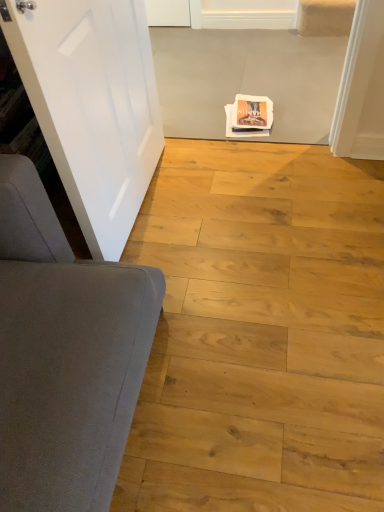
Question: Are white matte door at left and natural wood floor at center located far from each other?

Choices:
 (A) yes
 (B) no

Answer: (B)

Question: Is white matte door at left thinner than natural wood floor at center?

Choices:
 (A) yes
 (B) no

Answer: (A)

Question: From a real-world perspective, is white matte door at left positioned under natural wood floor at center based on gravity?

Choices:
 (A) no
 (B) yes

Answer: (A)

Question: Does white matte door at left have a greater width compared to natural wood floor at center?

Choices:
 (A) no
 (B) yes

Answer: (A)

Question: Is white matte door at left aimed at natural wood floor at center?

Choices:
 (A) yes
 (B) no

Answer: (A)

Question: Is white matte door at left outside of natural wood floor at center?

Choices:
 (A) no
 (B) yes

Answer: (B)

Question: From the image's perspective, is natural wood floor at center located beneath white matte door at left?

Choices:
 (A) no
 (B) yes

Answer: (B)

Question: Considering the relative sizes of natural wood floor at center and white matte door at left in the image provided, is natural wood floor at center smaller than white matte door at left?

Choices:
 (A) no
 (B) yes

Answer: (A)

Question: Considering the relative sizes of natural wood floor at center and white matte door at left in the image provided, is natural wood floor at center bigger than white matte door at left?

Choices:
 (A) yes
 (B) no

Answer: (A)

Question: From the image's perspective, is natural wood floor at center over white matte door at left?

Choices:
 (A) yes
 (B) no

Answer: (B)

Question: Is white matte door at left at the back of natural wood floor at center?

Choices:
 (A) no
 (B) yes

Answer: (A)

Question: Is natural wood floor at center positioned before white matte door at left?

Choices:
 (A) yes
 (B) no

Answer: (B)

Question: Is natural wood floor at center spatially inside white matte door at left, or outside of it?

Choices:
 (A) outside
 (B) inside

Answer: (A)